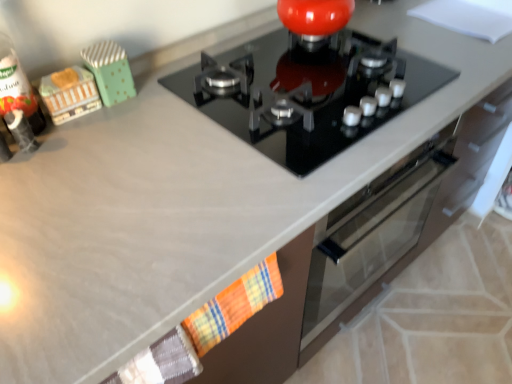
Question: Can you confirm if plaid fabric hand towel at lower center is thinner than black glass gas stove at center?

Choices:
 (A) no
 (B) yes

Answer: (B)

Question: Does plaid fabric hand towel at lower center have a greater width compared to black glass gas stove at center?

Choices:
 (A) no
 (B) yes

Answer: (A)

Question: Considering the relative sizes of plaid fabric hand towel at lower center and black glass gas stove at center in the image provided, is plaid fabric hand towel at lower center bigger than black glass gas stove at center?

Choices:
 (A) no
 (B) yes

Answer: (A)

Question: From a real-world perspective, does plaid fabric hand towel at lower center stand above black glass gas stove at center?

Choices:
 (A) no
 (B) yes

Answer: (A)

Question: Is plaid fabric hand towel at lower center closer to the viewer compared to black glass gas stove at center?

Choices:
 (A) no
 (B) yes

Answer: (B)

Question: Does point (222, 56) appear closer or farther from the camera than point (120, 57)?

Choices:
 (A) farther
 (B) closer

Answer: (A)

Question: Is black glass gas stove at center to the left or to the right of green polka dot fabric at upper left, the 1th toy in the right-to-left sequence, in the image?

Choices:
 (A) left
 (B) right

Answer: (B)

Question: Is black glass gas stove at center inside or outside of green polka dot fabric at upper left, arranged as the second toy when viewed from the left?

Choices:
 (A) outside
 (B) inside

Answer: (A)

Question: In terms of width, does black glass gas stove at center look wider or thinner when compared to green polka dot fabric at upper left, arranged as the second toy when viewed from the left?

Choices:
 (A) thin
 (B) wide

Answer: (B)

Question: Is wooden toy train at left, the 1th toy positioned from the left, wider or thinner than black glass gas stove at center?

Choices:
 (A) thin
 (B) wide

Answer: (A)

Question: Considering the positions of point [x=77, y=110] and point [x=353, y=69], is point [x=77, y=110] closer or farther from the camera than point [x=353, y=69]?

Choices:
 (A) farther
 (B) closer

Answer: (B)

Question: From the image's perspective, is wooden toy train at left, the 1th toy positioned from the left, above or below black glass gas stove at center?

Choices:
 (A) above
 (B) below

Answer: (B)

Question: Considering their positions, is wooden toy train at left, the 1th toy positioned from the left, located in front of or behind black glass gas stove at center?

Choices:
 (A) front
 (B) behind

Answer: (B)

Question: Is plaid fabric hand towel at lower center situated inside black glass gas stove at center or outside?

Choices:
 (A) outside
 (B) inside

Answer: (A)

Question: In terms of width, does plaid fabric hand towel at lower center look wider or thinner when compared to black glass gas stove at center?

Choices:
 (A) thin
 (B) wide

Answer: (A)